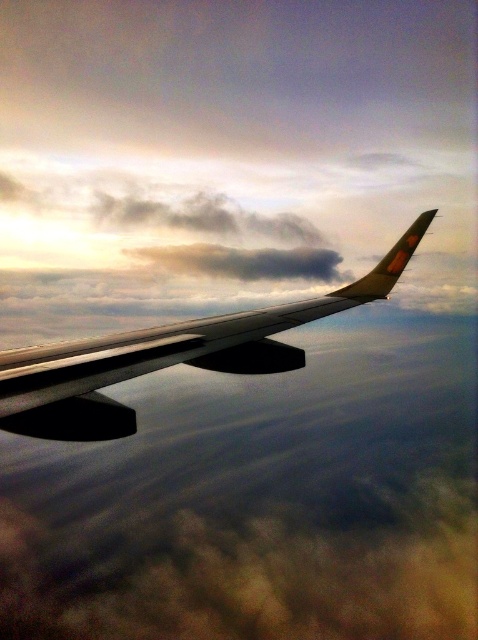
Question: Is metallic silver wing at upper center further to the viewer compared to gray fluffy cloud at upper center?

Choices:
 (A) yes
 (B) no

Answer: (B)

Question: Which object appears closest to the camera in this image?

Choices:
 (A) gray fluffy cloud at upper center
 (B) metallic silver wing at upper center

Answer: (B)

Question: Does metallic silver wing at upper center appear under gray fluffy cloud at upper center?

Choices:
 (A) no
 (B) yes

Answer: (B)

Question: Which point is farther to the camera?

Choices:
 (A) (204, 360)
 (B) (275, 264)

Answer: (B)

Question: Is the position of metallic silver wing at upper center less distant than that of gray fluffy cloud at upper center?

Choices:
 (A) yes
 (B) no

Answer: (A)